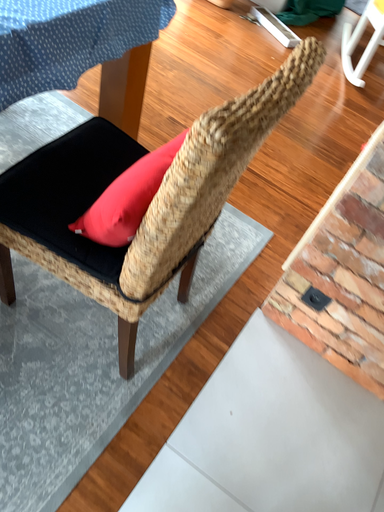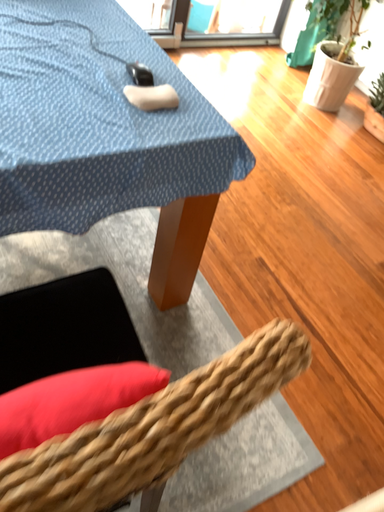
Question: How did the camera likely rotate when shooting the video?

Choices:
 (A) rotated left
 (B) rotated right

Answer: (A)